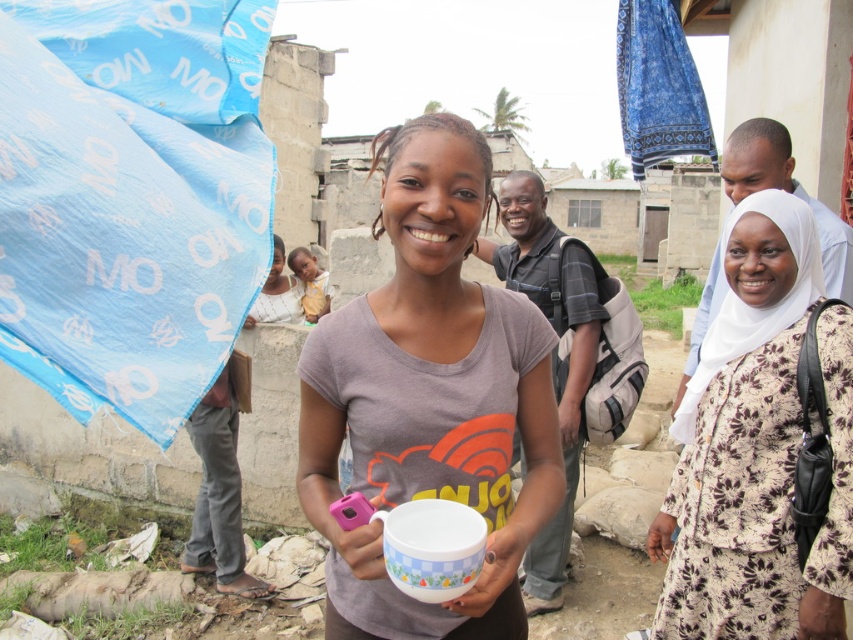
You are a photographer trying to take a clear photo of the white glossy mug at center and the white floral dress at center. Which object will appear closer to the camera in the photo?

The white glossy mug at center will appear closer to the camera in the photo because the white floral dress at center is behind it.

You are a delivery person trying to place both the white glossy mug at center and the yellow fabric baby at center into a box that can only hold items up to 10 inches wide. Given their sizes, can both items fit side by side in the box?

The white glossy mug at center is narrower than the yellow fabric baby at center. However, since the box can only hold items up to 10 inches wide, we need to know the exact width of both items to determine if their combined width is within the limit. Unfortunately, the provided information does not specify the exact measurements of either item, so it is impossible to confirm if they will fit together in the box.

What is located at the point marked by the coordinates (x=757, y=448) in the image?

The point marked by the coordinates (x=757, y=448) is located at the white floral dress at center.